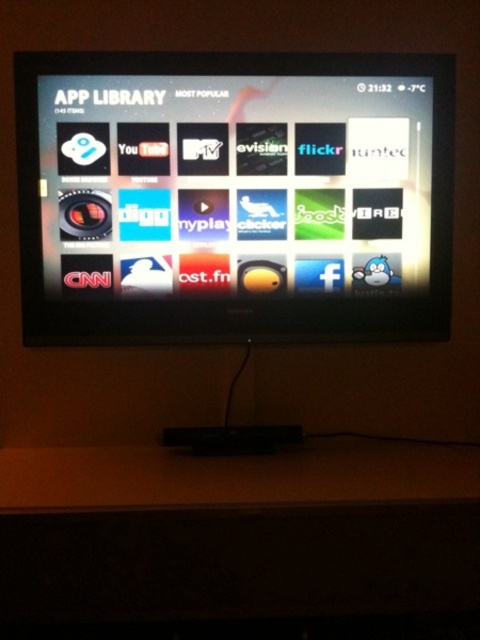
You are standing in front of the black glossy tv at center and the wooden table at lower center. Which object is positioned to the right side?

The wooden table at lower center is positioned to the right of the black glossy tv at center.

You are setting up a new media center and need to ensure the black glossy tv at center and the wooden table at lower center are arranged properly. Based on their sizes, which object should be placed higher to avoid blocking the view of the TV screen?

The black glossy tv at center is much taller than the wooden table at lower center, so to avoid blocking the view of the TV screen, the black glossy tv at center should be placed higher than the wooden table at lower center.